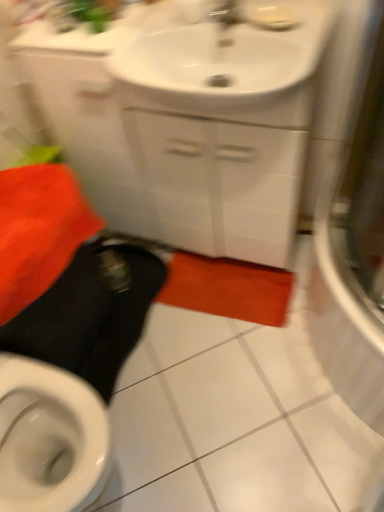
Question: From a real-world perspective, does white glossy sink at upper center stand above black rubber squat at lower left?

Choices:
 (A) yes
 (B) no

Answer: (A)

Question: From the image's perspective, would you say white glossy sink at upper center is positioned over black rubber squat at lower left?

Choices:
 (A) yes
 (B) no

Answer: (A)

Question: Is white glossy sink at upper center turned away from black rubber squat at lower left?

Choices:
 (A) no
 (B) yes

Answer: (A)

Question: Can you confirm if white glossy sink at upper center is thinner than black rubber squat at lower left?

Choices:
 (A) yes
 (B) no

Answer: (A)

Question: Considering the relative sizes of white glossy sink at upper center and black rubber squat at lower left in the image provided, is white glossy sink at upper center bigger than black rubber squat at lower left?

Choices:
 (A) no
 (B) yes

Answer: (A)

Question: Can you confirm if white glossy sink at upper center is positioned to the right of black rubber squat at lower left?

Choices:
 (A) yes
 (B) no

Answer: (A)

Question: Could transparent glass shower door at right be considered to be inside black rubber squat at lower left?

Choices:
 (A) yes
 (B) no

Answer: (B)

Question: Considering the relative sizes of black rubber squat at lower left and transparent glass shower door at right in the image provided, is black rubber squat at lower left shorter than transparent glass shower door at right?

Choices:
 (A) yes
 (B) no

Answer: (B)

Question: Is black rubber squat at lower left taller than transparent glass shower door at right?

Choices:
 (A) yes
 (B) no

Answer: (A)

Question: Does black rubber squat at lower left turn towards transparent glass shower door at right?

Choices:
 (A) no
 (B) yes

Answer: (A)

Question: From the image's perspective, would you say black rubber squat at lower left is positioned over transparent glass shower door at right?

Choices:
 (A) yes
 (B) no

Answer: (B)

Question: Is black rubber squat at lower left not inside transparent glass shower door at right?

Choices:
 (A) no
 (B) yes

Answer: (B)

Question: Considering the relative sizes of white glossy cabinet at upper center and black rubber squat at lower left in the image provided, is white glossy cabinet at upper center smaller than black rubber squat at lower left?

Choices:
 (A) yes
 (B) no

Answer: (B)